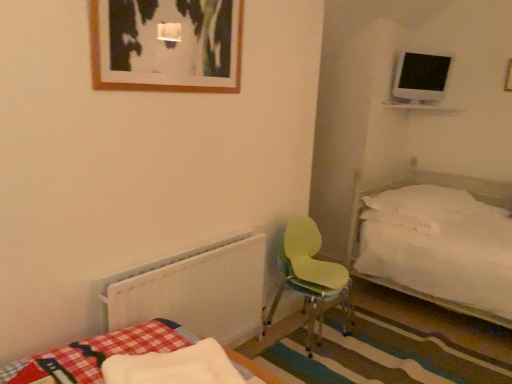
The image size is (512, 384). In order to click on white soft pillow at right in this screenshot , I will do `click(422, 202)`.

Image resolution: width=512 pixels, height=384 pixels. Describe the element at coordinates (166, 45) in the screenshot. I see `wooden picture frame at upper center` at that location.

You are a GUI agent. You are given a task and a screenshot of the screen. Output one action in this format:
    pyautogui.click(x=<x>, y=<y>)
    Task: Click on the white fluffy mattress at lower left
    The image size is (512, 384).
    Given the screenshot: What is the action you would take?
    pyautogui.click(x=174, y=367)

Who is bigger, light green plastic chair at center or wooden picture frame at upper center?

With larger size is light green plastic chair at center.

How many degrees apart are the facing directions of light green plastic chair at center and wooden picture frame at upper center?

0.000243 degrees separate the facing orientations of light green plastic chair at center and wooden picture frame at upper center.

Is point (340, 265) positioned before point (236, 39)?

No, (340, 265) is behind (236, 39).

From a real-world perspective, is light green plastic chair at center physically above wooden picture frame at upper center?

Incorrect, from a real-world perspective, light green plastic chair at center is lower than wooden picture frame at upper center.

Considering the relative sizes of white soft pillow at right and wooden picture frame at upper center in the image provided, is white soft pillow at right bigger than wooden picture frame at upper center?

Indeed, white soft pillow at right has a larger size compared to wooden picture frame at upper center.

Between white soft pillow at right and wooden picture frame at upper center, which one appears on the left side from the viewer's perspective?

wooden picture frame at upper center.

I want to click on picture frame above the white soft pillow at right (from the image's perspective), so point(166,45).

Considering the sizes of white soft pillow at right and wooden picture frame at upper center in the image, is white soft pillow at right wider or thinner than wooden picture frame at upper center?

In the image, white soft pillow at right appears to be wider than wooden picture frame at upper center.

Would you consider light green plastic chair at center to be distant from white fluffy mattress at lower left?

light green plastic chair at center is far away from white fluffy mattress at lower left.

Identify the location of chair behind the white fluffy mattress at lower left. (311, 278).

From the image's perspective, would you say light green plastic chair at center is shown under white fluffy mattress at lower left?

No, from the image's perspective, light green plastic chair at center is not below white fluffy mattress at lower left.

Do you think light green plastic chair at center is within white fluffy mattress at lower left, or outside of it?

light green plastic chair at center is outside white fluffy mattress at lower left.

Looking at their sizes, would you say white soft pillow at right is wider or thinner than white fluffy mattress at lower left?

In the image, white soft pillow at right appears to be wider than white fluffy mattress at lower left.

From the image's perspective, is white soft pillow at right above or below white fluffy mattress at lower left?

white soft pillow at right is above white fluffy mattress at lower left.

Is white soft pillow at right not inside white fluffy mattress at lower left?

Yes, white soft pillow at right is not within white fluffy mattress at lower left.

Looking at this image, is white soft pillow at right looking in the opposite direction of white fluffy mattress at lower left?

That's not correct — white soft pillow at right is not looking away from white fluffy mattress at lower left.

Is white plastic radiator at lower left touching wooden picture frame at upper center?

No, white plastic radiator at lower left is not in contact with wooden picture frame at upper center.

Is white plastic radiator at lower left aimed at wooden picture frame at upper center?

No, white plastic radiator at lower left is not oriented towards wooden picture frame at upper center.

Which point is more distant from viewer, (x=162, y=307) or (x=110, y=58)?

The point (x=162, y=307) is farther.

Can you confirm if white plastic radiator at lower left is taller than wooden picture frame at upper center?

Yes, white plastic radiator at lower left is taller than wooden picture frame at upper center.

Which of these two, white plastic radiator at lower left or light green plastic chair at center, is bigger?

light green plastic chair at center is bigger.

Which object is more forward, white plastic radiator at lower left or light green plastic chair at center?

white plastic radiator at lower left is more forward.

Is white plastic radiator at lower left not near light green plastic chair at center?

No, white plastic radiator at lower left is in close proximity to light green plastic chair at center.

Considering the positions of objects white plastic radiator at lower left and light green plastic chair at center in the image provided, who is more to the left, white plastic radiator at lower left or light green plastic chair at center?

From the viewer's perspective, white plastic radiator at lower left appears more on the left side.

Who is smaller, white fluffy mattress at lower left or white plastic radiator at lower left?

With smaller size is white fluffy mattress at lower left.

Is white plastic radiator at lower left at the back of white fluffy mattress at lower left?

No, white fluffy mattress at lower left is not facing the opposite direction of white plastic radiator at lower left.

Is white fluffy mattress at lower left at the left side of white plastic radiator at lower left?

Incorrect, white fluffy mattress at lower left is not on the left side of white plastic radiator at lower left.

You are a GUI agent. You are given a task and a screenshot of the screen. Output one action in this format:
    pyautogui.click(x=<x>, y=<y>)
    Task: Click on the chair below the wooden picture frame at upper center (from the image's perspective)
    Image resolution: width=512 pixels, height=384 pixels.
    Given the screenshot: What is the action you would take?
    pyautogui.click(x=311, y=278)

Where is `pillow below the wooden picture frame at upper center (from a real-world perspective)`? pillow below the wooden picture frame at upper center (from a real-world perspective) is located at coordinates (422, 202).

Considering their positions, is wooden picture frame at upper center positioned further to white soft pillow at right than white plastic radiator at lower left?

wooden picture frame at upper center lies further to white soft pillow at right than the other object.

Looking at the image, which one is located further to light green plastic chair at center, white fluffy mattress at lower left or white soft pillow at right?

white fluffy mattress at lower left is further to light green plastic chair at center.

Based on their spatial positions, is white fluffy mattress at lower left or light green plastic chair at center further from white plastic radiator at lower left?

light green plastic chair at center.

When comparing their distances from white fluffy mattress at lower left, does wooden picture frame at upper center or white plastic radiator at lower left seem further?

Among the two, wooden picture frame at upper center is located further to white fluffy mattress at lower left.

Based on their spatial positions, is white plastic radiator at lower left or white fluffy mattress at lower left further from light green plastic chair at center?

white fluffy mattress at lower left lies further to light green plastic chair at center than the other object.

Considering their positions, is wooden picture frame at upper center positioned closer to white plastic radiator at lower left than light green plastic chair at center?

light green plastic chair at center.

Based on their spatial positions, is wooden picture frame at upper center or light green plastic chair at center closer to white fluffy mattress at lower left?

wooden picture frame at upper center lies closer to white fluffy mattress at lower left than the other object.

Estimate the real-world distances between objects in this image. Which object is closer to wooden picture frame at upper center, light green plastic chair at center or white plastic radiator at lower left?

white plastic radiator at lower left.

Find the location of a particular element. chair situated between wooden picture frame at upper center and white soft pillow at right from left to right is located at coordinates (311, 278).

Where is `chair between wooden picture frame at upper center and white plastic radiator at lower left in the up-down direction`? Image resolution: width=512 pixels, height=384 pixels. chair between wooden picture frame at upper center and white plastic radiator at lower left in the up-down direction is located at coordinates (311, 278).

The height and width of the screenshot is (384, 512). I want to click on chair between white fluffy mattress at lower left and white soft pillow at right in the front-back direction, so click(311, 278).

I want to click on chair located between white plastic radiator at lower left and white soft pillow at right in the left-right direction, so click(311, 278).